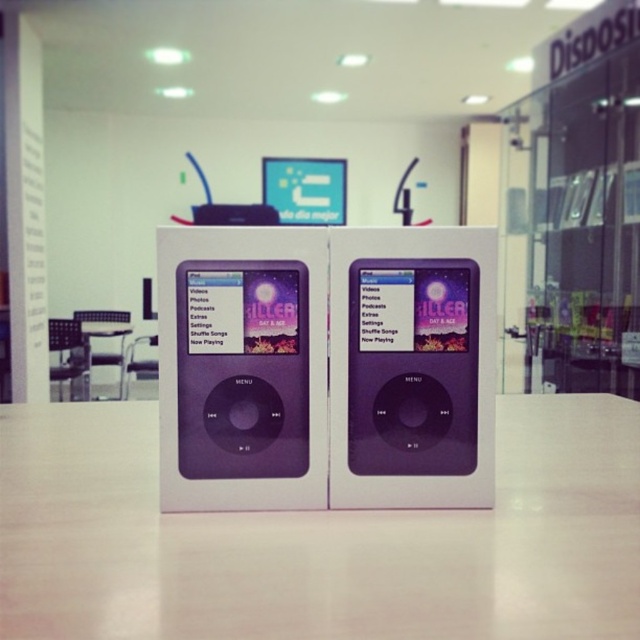
Question: Considering the relative positions of purple glossy ipod at center and white glossy table at lower center in the image provided, where is purple glossy ipod at center located with respect to white glossy table at lower center?

Choices:
 (A) left
 (B) right

Answer: (B)

Question: Which of the following is the farthest from the observer?

Choices:
 (A) (122, 353)
 (B) (337, 262)
 (C) (225, 515)

Answer: (A)

Question: Estimate the real-world distances between objects in this image. Which object is closer to the purple glossy ipod at center?

Choices:
 (A) purple matte/ipod at center
 (B) white matte table at center
 (C) white glossy table at lower center

Answer: (A)

Question: In this image, where is white matte table at center located relative to purple matte/ipod at center?

Choices:
 (A) above
 (B) below

Answer: (B)

Question: Considering the relative positions of white matte table at center and purple glossy ipod at center in the image provided, where is white matte table at center located with respect to purple glossy ipod at center?

Choices:
 (A) above
 (B) below

Answer: (B)

Question: Which of the following is the farthest from the observer?

Choices:
 (A) white matte table at center
 (B) purple glossy ipod at center
 (C) white glossy table at lower center
 (D) purple matte/ipod at center

Answer: (C)